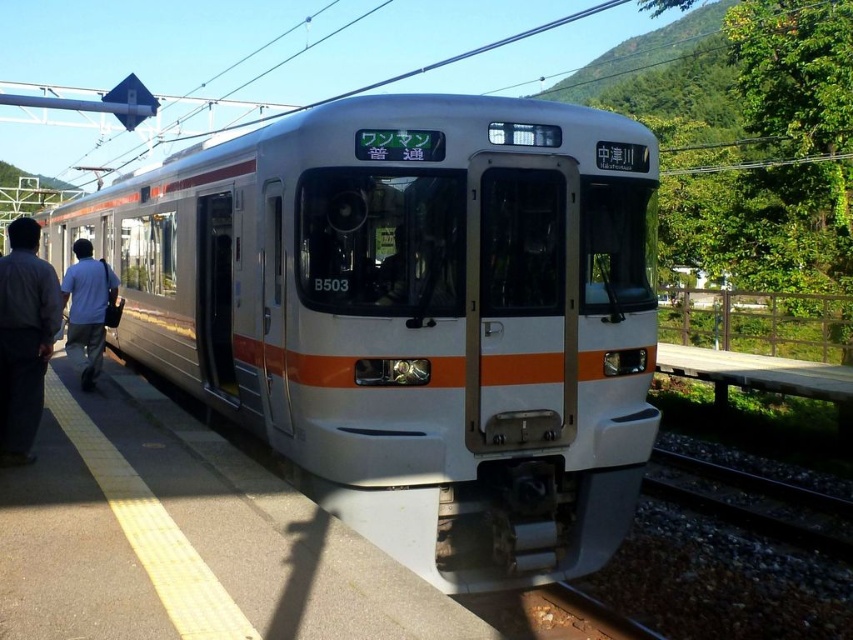
Question: Which point is closer to the camera?

Choices:
 (A) (82, 380)
 (B) (12, 307)
 (C) (136, 225)

Answer: (B)

Question: Based on their relative distances, which object is farther from the dark gray fabric pants at left?

Choices:
 (A) white glossy train at center
 (B) light blue shirt at left

Answer: (A)

Question: Where is dark gray fabric pants at left located in relation to light blue shirt at left in the image?

Choices:
 (A) right
 (B) left

Answer: (A)

Question: Is the position of dark gray fabric pants at left more distant than that of light blue shirt at left?

Choices:
 (A) no
 (B) yes

Answer: (A)

Question: Does dark gray fabric pants at left have a smaller size compared to light blue shirt at left?

Choices:
 (A) no
 (B) yes

Answer: (B)

Question: Which is nearer to the light blue shirt at left?

Choices:
 (A) white glossy train at center
 (B) dark gray fabric pants at left

Answer: (B)